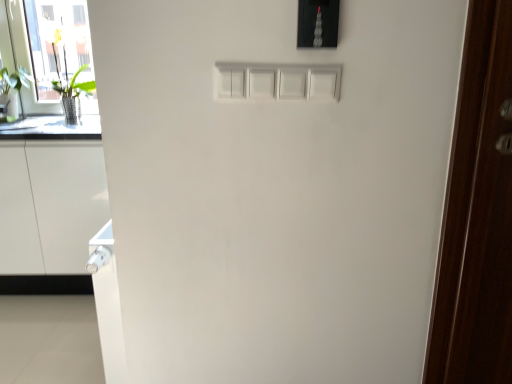
What do you see at coordinates (477, 214) in the screenshot? The width and height of the screenshot is (512, 384). I see `dark wood door at right` at bounding box center [477, 214].

The width and height of the screenshot is (512, 384). What are the coordinates of `white glossy cabinet at lower left` in the screenshot? It's located at (50, 205).

Image resolution: width=512 pixels, height=384 pixels. What are the coordinates of `transparent glass door at left` in the screenshot? It's located at (58, 44).

The image size is (512, 384). What are the coordinates of `green leafy plant at left` in the screenshot? It's located at (x=12, y=92).

From a real-world perspective, is white glossy cabinet at lower left under satin black light switch at upper center?

Yes.

Can you confirm if white glossy cabinet at lower left is smaller than satin black light switch at upper center?

No, white glossy cabinet at lower left is not smaller than satin black light switch at upper center.

Considering the positions of objects white glossy cabinet at lower left and satin black light switch at upper center in the image provided, who is more to the left, white glossy cabinet at lower left or satin black light switch at upper center?

white glossy cabinet at lower left.

From their relative heights in the image, would you say white glossy cabinet at lower left is taller or shorter than satin black light switch at upper center?

In the image, white glossy cabinet at lower left appears to be taller than satin black light switch at upper center.

Is the depth of dark wood door at right less than that of satin black light switch at upper center?

Yes, dark wood door at right is in front of satin black light switch at upper center.

From a real-world perspective, is dark wood door at right physically located above or below satin black light switch at upper center?

In terms of real-world spatial position, dark wood door at right is below satin black light switch at upper center.

Can you see dark wood door at right touching satin black light switch at upper center?

No, dark wood door at right is not touching satin black light switch at upper center.

Considering the points (475, 133) and (309, 37), which point is in front, point (475, 133) or point (309, 37)?

The point (309, 37) is more forward.

Considering the points (84, 56) and (3, 114), which point is behind, point (84, 56) or point (3, 114)?

The point (3, 114) is farther from the camera.

Is transparent glass door at left positioned before green leafy plant at left?

That is True.

From the image's perspective, which one is positioned higher, transparent glass door at left or green leafy plant at left?

transparent glass door at left.

Which of these two, satin black light switch at upper center or green leafy plant at left, is bigger?

green leafy plant at left is bigger.

Is satin black light switch at upper center taller than green leafy plant at left?

No.

Is satin black light switch at upper center to the left of green leafy plant at left from the viewer's perspective?

No, satin black light switch at upper center is not to the left of green leafy plant at left.

From the image's perspective, is satin black light switch at upper center located above or below green leafy plant at left?

Based on their image positions, satin black light switch at upper center is located beneath green leafy plant at left.

From a real-world perspective, is dark wood door at right positioned above or below green leafy plant at left?

Clearly, from a real-world perspective, dark wood door at right is below green leafy plant at left.

Which is behind, point (510, 260) or point (6, 96)?

Point (6, 96)

Find the location of a particular element. Image resolution: width=512 pixels, height=384 pixels. plant above the dark wood door at right (from the image's perspective) is located at coordinates (12, 92).

In terms of size, does white glossy cabinet at lower left appear bigger or smaller than transparent glass door at left?

Clearly, white glossy cabinet at lower left is larger in size than transparent glass door at left.

Which is more distant, (20, 242) or (29, 7)?

The point (29, 7) is behind.

Is white glossy cabinet at lower left oriented towards transparent glass door at left?

No, white glossy cabinet at lower left is not oriented towards transparent glass door at left.

Looking at this image, measure the distance between white glossy cabinet at lower left and dark wood door at right.

white glossy cabinet at lower left and dark wood door at right are 1.81 meters apart from each other.

Considering the relative sizes of white glossy cabinet at lower left and dark wood door at right in the image provided, is white glossy cabinet at lower left shorter than dark wood door at right?

Indeed, white glossy cabinet at lower left has a lesser height compared to dark wood door at right.

What's the angular difference between white glossy cabinet at lower left and dark wood door at right's facing directions?

The angle between the facing direction of white glossy cabinet at lower left and the facing direction of dark wood door at right is 0.243 degrees.

Looking at this image, can you confirm if white glossy cabinet at lower left is bigger than dark wood door at right?

Yes, white glossy cabinet at lower left is bigger than dark wood door at right.

Identify the location of cabinetry below the satin black light switch at upper center (from the image's perspective). (50, 205).

You are a GUI agent. You are given a task and a screenshot of the screen. Output one action in this format:
    pyautogui.click(x=<x>, y=<y>)
    Task: Click on the light switch that is on the left side of dark wood door at right
    This screenshot has height=384, width=512.
    Given the screenshot: What is the action you would take?
    pyautogui.click(x=318, y=23)

Considering their positions, is white glossy cabinet at lower left positioned closer to transparent glass door at left than dark wood door at right?

The object closer to transparent glass door at left is white glossy cabinet at lower left.

From the image, which object appears to be farther from green leafy plant at left, satin black light switch at upper center or white glossy cabinet at lower left?

The object further to green leafy plant at left is satin black light switch at upper center.

When comparing their distances from dark wood door at right, does transparent glass door at left or white glossy cabinet at lower left seem further?

The object further to dark wood door at right is transparent glass door at left.

When comparing their distances from satin black light switch at upper center, does green leafy plant at left or white glossy cabinet at lower left seem closer?

Based on the image, white glossy cabinet at lower left appears to be nearer to satin black light switch at upper center.

Considering their positions, is satin black light switch at upper center positioned closer to green leafy plant at left than dark wood door at right?

Based on the image, satin black light switch at upper center appears to be nearer to green leafy plant at left.

Estimate the real-world distances between objects in this image. Which object is closer to satin black light switch at upper center, transparent glass door at left or dark wood door at right?

The object closer to satin black light switch at upper center is dark wood door at right.

Estimate the real-world distances between objects in this image. Which object is further from satin black light switch at upper center, transparent glass door at left or green leafy plant at left?

Based on the image, green leafy plant at left appears to be further to satin black light switch at upper center.

When comparing their distances from white glossy cabinet at lower left, does satin black light switch at upper center or dark wood door at right seem closer?

satin black light switch at upper center.

At what (x,y) coordinates should I click in order to perform the action: click on glass door located between green leafy plant at left and dark wood door at right in the left-right direction. Please return your answer as a coordinate pair (x, y). The image size is (512, 384). Looking at the image, I should click on (58, 44).

At what (x,y) coordinates should I click in order to perform the action: click on light switch between transparent glass door at left and dark wood door at right from left to right. Please return your answer as a coordinate pair (x, y). Looking at the image, I should click on (318, 23).

I want to click on light switch situated between white glossy cabinet at lower left and dark wood door at right from left to right, so [x=318, y=23].

You are a GUI agent. You are given a task and a screenshot of the screen. Output one action in this format:
    pyautogui.click(x=<x>, y=<y>)
    Task: Click on the plant between transparent glass door at left and white glossy cabinet at lower left in the up-down direction
    This screenshot has width=512, height=384.
    Given the screenshot: What is the action you would take?
    pyautogui.click(x=12, y=92)